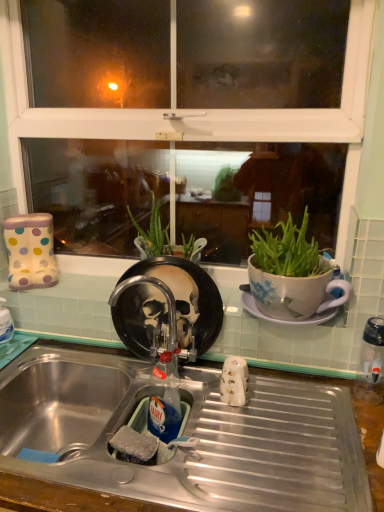
Locate an element on the screen. This screenshot has width=384, height=512. unoccupied area in front of metallic faucet at center is located at coordinates (149, 395).